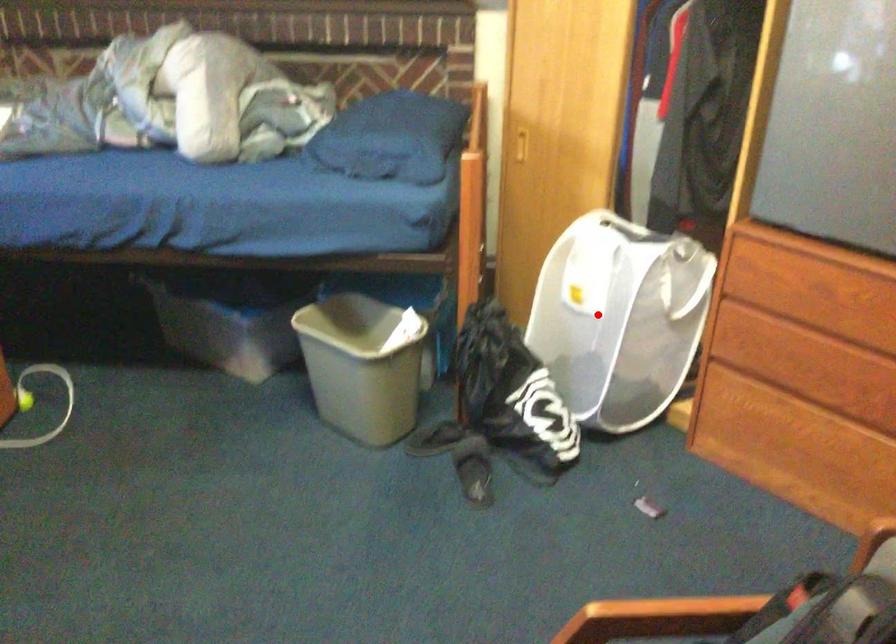
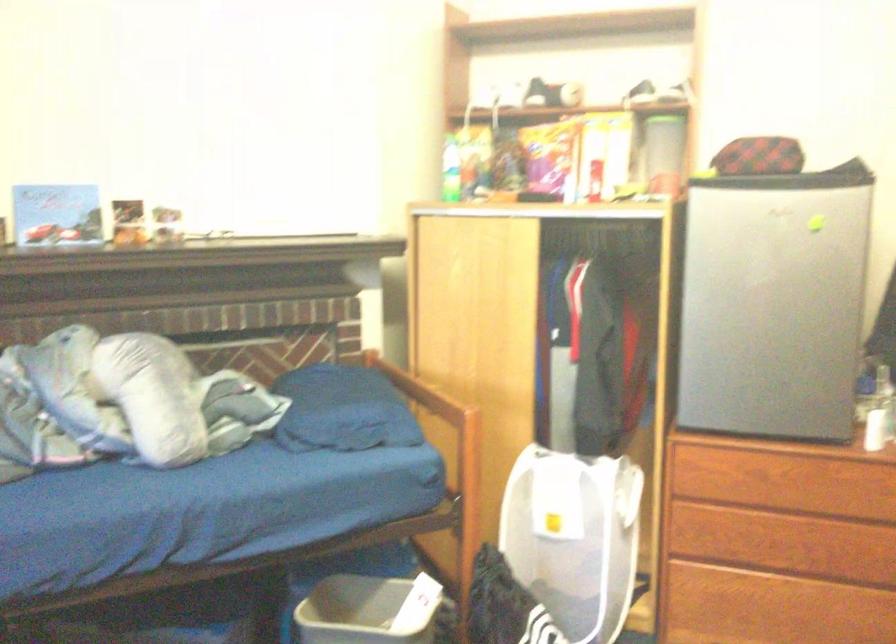
Question: A red point is marked in image1. In image2, is the corresponding 3D point closer to the camera or farther? Reply with the corresponding letter.

Choices:
 (A) The corresponding 3D point is closer.
 (B) The corresponding 3D point is farther.

Answer: (B)